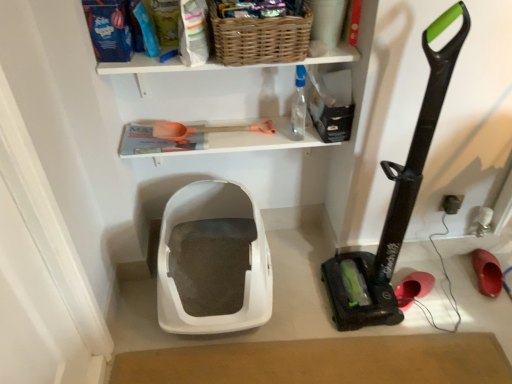
Question: Considering the relative positions of white wicker basket at upper center and woven brown basket at upper center in the image provided, is white wicker basket at upper center to the right of woven brown basket at upper center from the viewer's perspective?

Choices:
 (A) yes
 (B) no

Answer: (B)

Question: Does white wicker basket at upper center lie in front of woven brown basket at upper center?

Choices:
 (A) no
 (B) yes

Answer: (A)

Question: Is white wicker basket at upper center further to the viewer compared to woven brown basket at upper center?

Choices:
 (A) yes
 (B) no

Answer: (A)

Question: Is white wicker basket at upper center to the left of woven brown basket at upper center from the viewer's perspective?

Choices:
 (A) no
 (B) yes

Answer: (B)

Question: From a real-world perspective, is white wicker basket at upper center positioned under woven brown basket at upper center based on gravity?

Choices:
 (A) yes
 (B) no

Answer: (A)

Question: Is white wicker basket at upper center taller than woven brown basket at upper center?

Choices:
 (A) yes
 (B) no

Answer: (A)

Question: Considering the relative sizes of woven brown basket at upper center and white wicker basket at upper center in the image provided, is woven brown basket at upper center shorter than white wicker basket at upper center?

Choices:
 (A) no
 (B) yes

Answer: (B)

Question: Considering the relative positions of woven brown basket at upper center and white wicker basket at upper center in the image provided, is woven brown basket at upper center to the right of white wicker basket at upper center from the viewer's perspective?

Choices:
 (A) no
 (B) yes

Answer: (B)

Question: Is woven brown basket at upper center bigger than white wicker basket at upper center?

Choices:
 (A) yes
 (B) no

Answer: (B)

Question: From the image's perspective, is woven brown basket at upper center beneath white wicker basket at upper center?

Choices:
 (A) no
 (B) yes

Answer: (A)

Question: Is there a large distance between woven brown basket at upper center and white wicker basket at upper center?

Choices:
 (A) yes
 (B) no

Answer: (B)

Question: Can you confirm if woven brown basket at upper center is smaller than white wicker basket at upper center?

Choices:
 (A) no
 (B) yes

Answer: (B)

Question: Considering the relative sizes of rubberized red shoe at lower right, the first footwear from the left, and rubber matte shoe at lower right, the second footwear positioned from the left, in the image provided, is rubberized red shoe at lower right, the first footwear from the left, bigger than rubber matte shoe at lower right, the second footwear positioned from the left,?

Choices:
 (A) yes
 (B) no

Answer: (B)